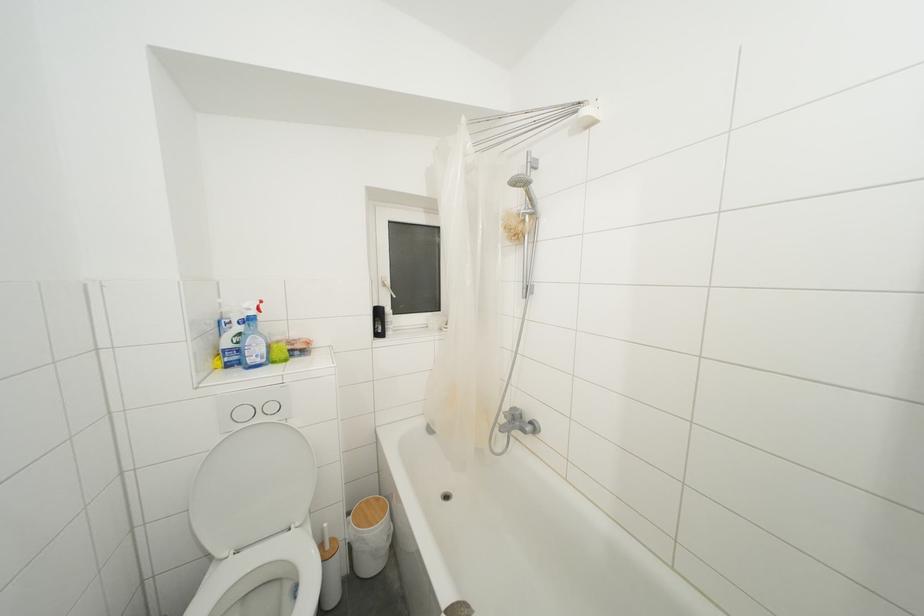
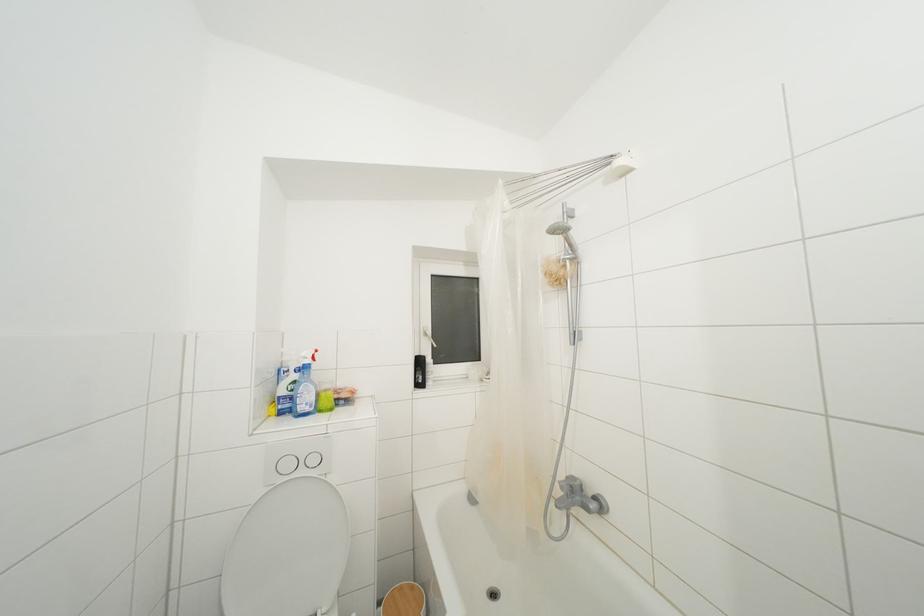
Question: The images are taken continuously from a first-person perspective. In which direction is your viewpoint rotating?

Choices:
 (A) Left
 (B) Right
 (C) Up
 (D) Down

Answer: (C)